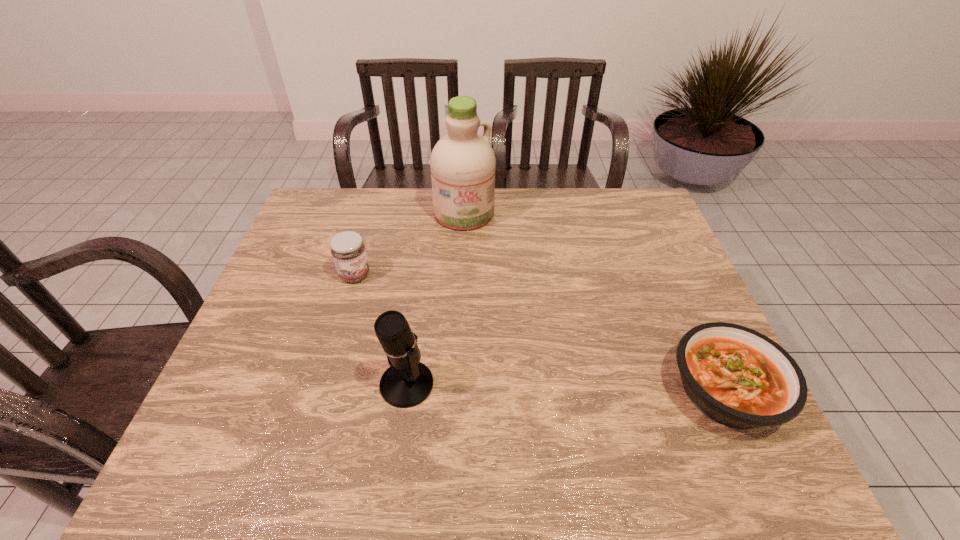
Identify the location of vacant space located 0.170m on the front label of the leftmost object. (410, 309).

Locate an element on the screen. vacant space situated on the front label of the leftmost object is located at coordinates (442, 329).

Locate an element on the screen. The image size is (960, 540). free space located 0.260m on the front label of the farthest object is located at coordinates (497, 287).

You are a GUI agent. You are given a task and a screenshot of the screen. Output one action in this format:
    pyautogui.click(x=<x>, y=<y>)
    Task: Click on the blank space located on the front label of the farthest object
    
    Given the screenshot: What is the action you would take?
    pyautogui.click(x=493, y=278)

Locate an element on the screen. free location located on the front label of the farthest object is located at coordinates (494, 280).

The width and height of the screenshot is (960, 540). Find the location of `object present at the far edge`. object present at the far edge is located at coordinates (462, 163).

Locate an element on the screen. This screenshot has height=540, width=960. microphone located at the near edge is located at coordinates (407, 382).

Identify the location of stew that is at the near edge. (738, 377).

The image size is (960, 540). I want to click on object present at the right edge, so click(738, 377).

This screenshot has width=960, height=540. In order to click on object that is at the near right corner in this screenshot , I will do `click(738, 377)`.